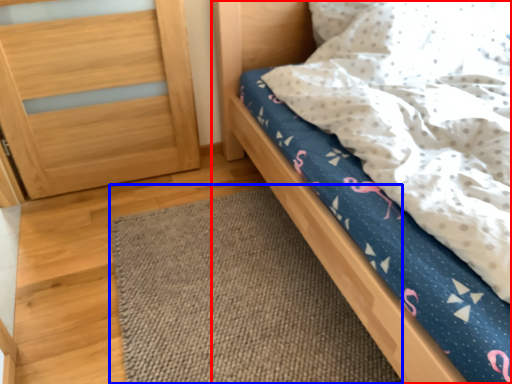
Question: Which point is closer to the camera, bed (highlighted by a red box) or mat (highlighted by a blue box)?

Choices:
 (A) bed
 (B) mat

Answer: (A)